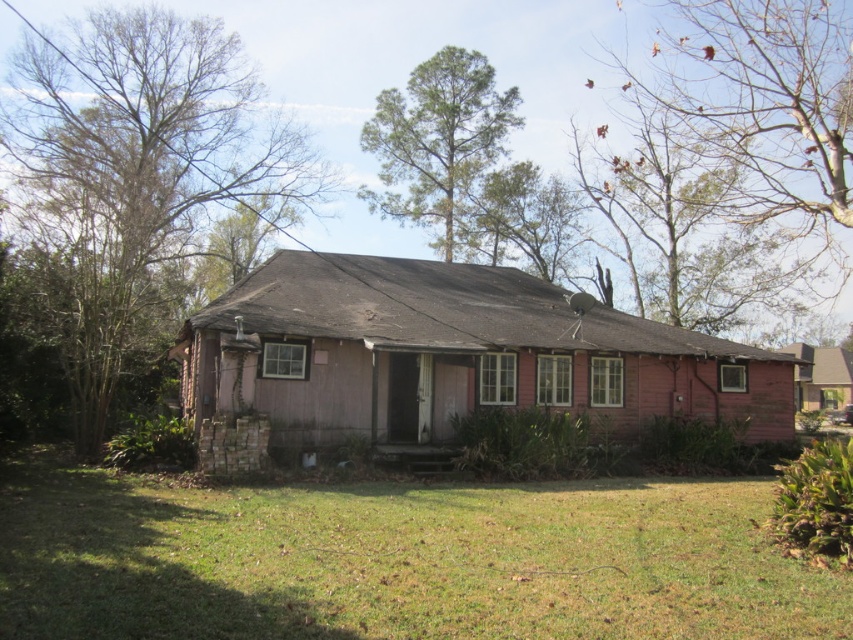
Between point (25, 474) and point (718, 173), which one is positioned behind?

The point (718, 173) is more distant.

Does point (24, 547) come farther from viewer compared to point (631, 198)?

No, (24, 547) is in front of (631, 198).

What do you see at coordinates (401, 560) in the screenshot? This screenshot has height=640, width=853. I see `green grass at lower center` at bounding box center [401, 560].

Identify the location of green grass at lower center. (401, 560).

Which is in front, point (235, 93) or point (675, 275)?

Point (675, 275)

Can you confirm if bare branches at left is bigger than brown leafy tree at upper right?

Correct, bare branches at left is larger in size than brown leafy tree at upper right.

Does point (238, 112) come in front of point (683, 314)?

No.

This screenshot has height=640, width=853. I want to click on bare branches at left, so click(x=136, y=173).

In the scene shown: Who is positioned more to the right, green grass at lower center or bare branches at left?

green grass at lower center

Is point (421, 627) closer to viewer compared to point (49, 275)?

Yes.

Is point (723, 499) positioned in front of point (61, 122)?

That is True.

The image size is (853, 640). I want to click on green grass at lower center, so click(401, 560).